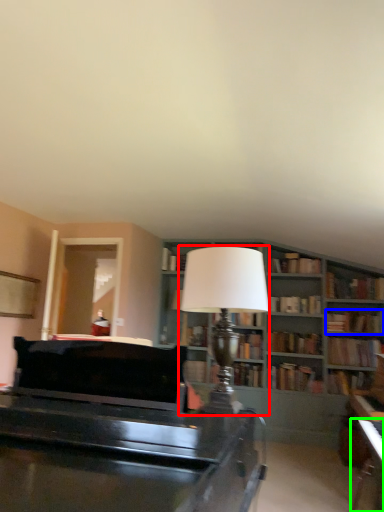
Question: Which object is positioned closest to table lamp (highlighted by a red box)? Select from book (highlighted by a blue box) and table (highlighted by a green box).

Choices:
 (A) book
 (B) table

Answer: (B)